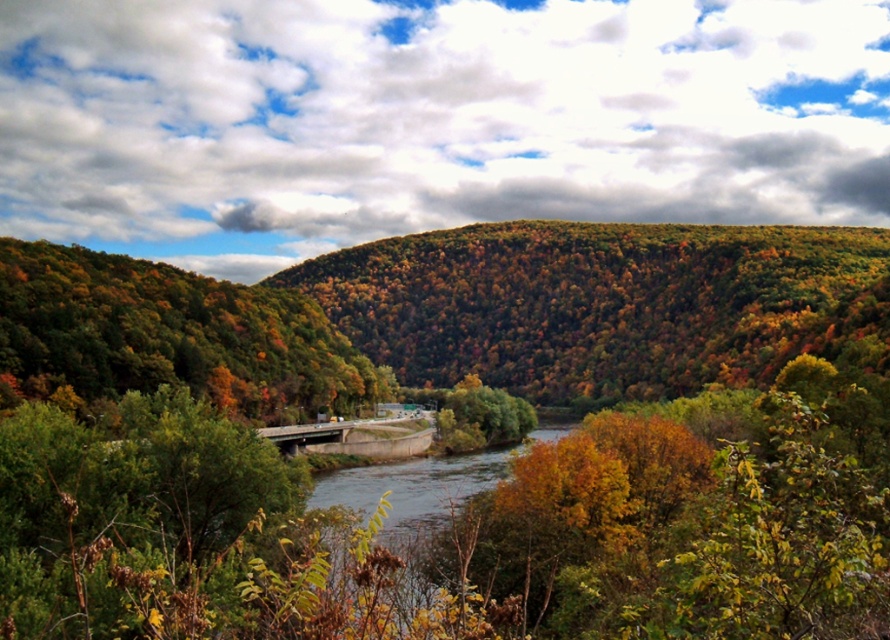
Is green leafy hillside at center below autumn foliage at center?

Yes.

In the scene shown: Who is higher up, green leafy hillside at center or autumn foliage at center?

autumn foliage at center is higher up.

Is point (834, 609) positioned after point (719, 353)?

That is False.

Locate an element on the screen. Image resolution: width=890 pixels, height=640 pixels. green leafy hillside at center is located at coordinates (704, 449).

Which of these two, autumn foliage at center or green leafy trees at center, stands shorter?

Standing shorter between the two is green leafy trees at center.

Which is in front, point (774, 262) or point (4, 273)?

Point (4, 273)

The image size is (890, 640). I want to click on autumn foliage at center, so click(x=603, y=304).

Who is more forward, [490,576] or [472,486]?

Positioned in front is point [490,576].

Does green leafy hillside at center have a larger size compared to smooth concrete river at center?

Indeed, green leafy hillside at center has a larger size compared to smooth concrete river at center.

Between point (19, 428) and point (403, 513), which one is positioned behind?

The point (403, 513) is behind.

At what (x,y) coordinates should I click in order to perform the action: click on green leafy hillside at center. Please return your answer as a coordinate pair (x, y). This screenshot has height=640, width=890. Looking at the image, I should click on (704, 449).